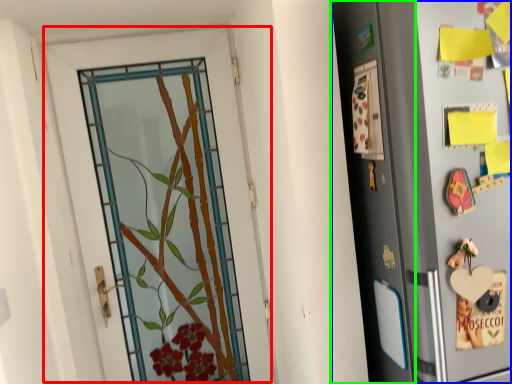
Question: Which object is positioned closest to door (highlighted by a red box)? Select from refrigerator (highlighted by a blue box) and screen door (highlighted by a green box).

Choices:
 (A) refrigerator
 (B) screen door

Answer: (B)